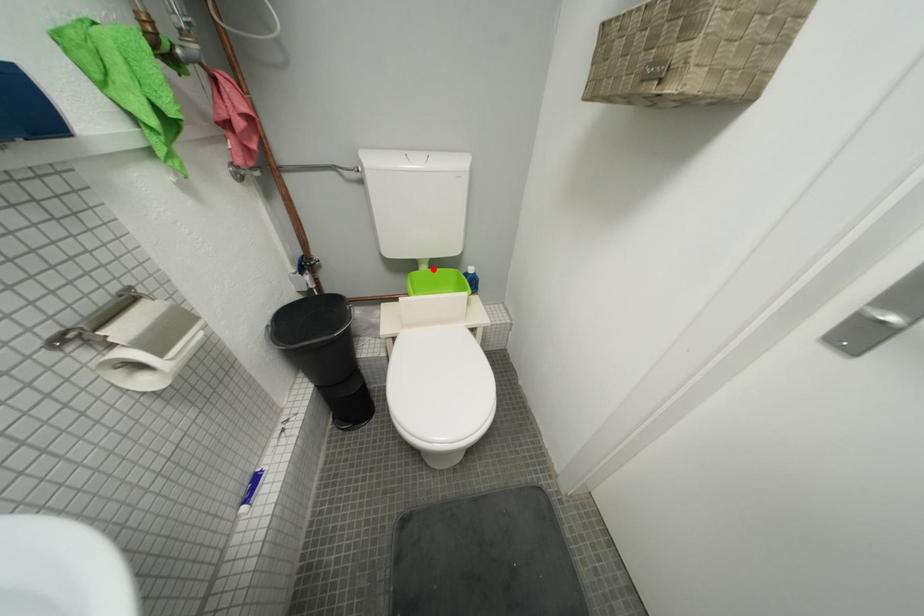
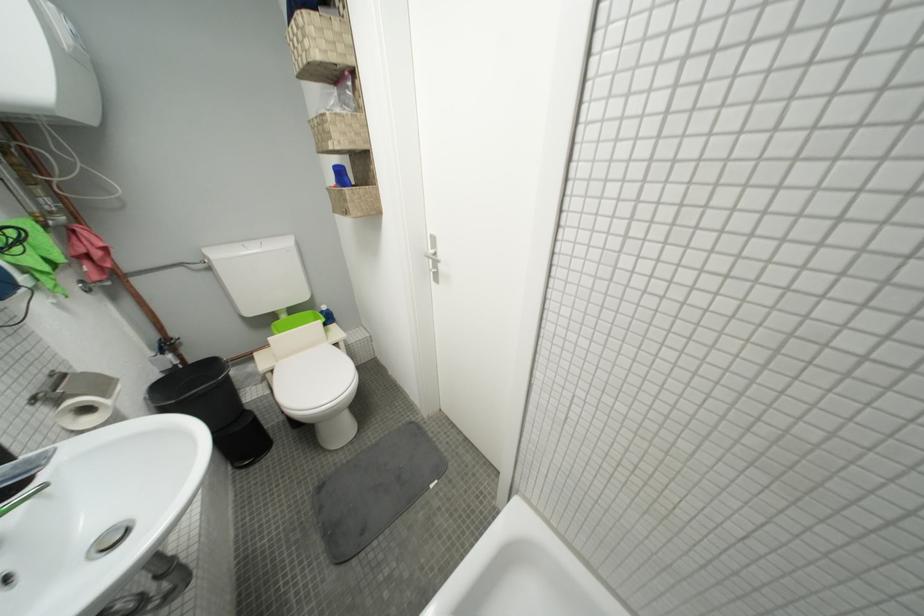
Question: A red point is marked in image1. In image2, is the corresponding 3D point closer to the camera or farther? Reply with the corresponding letter.

Choices:
 (A) The corresponding 3D point is closer.
 (B) The corresponding 3D point is farther.

Answer: (A)